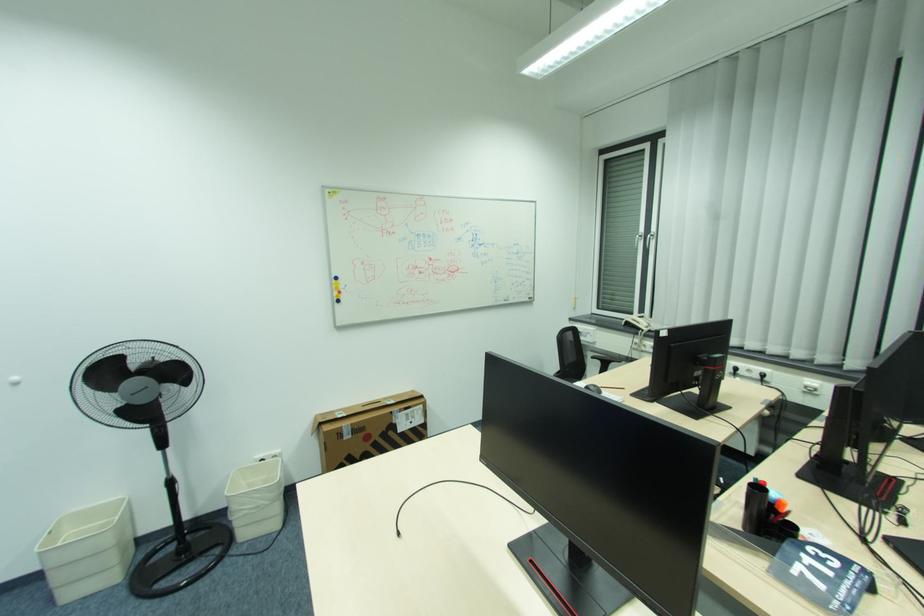
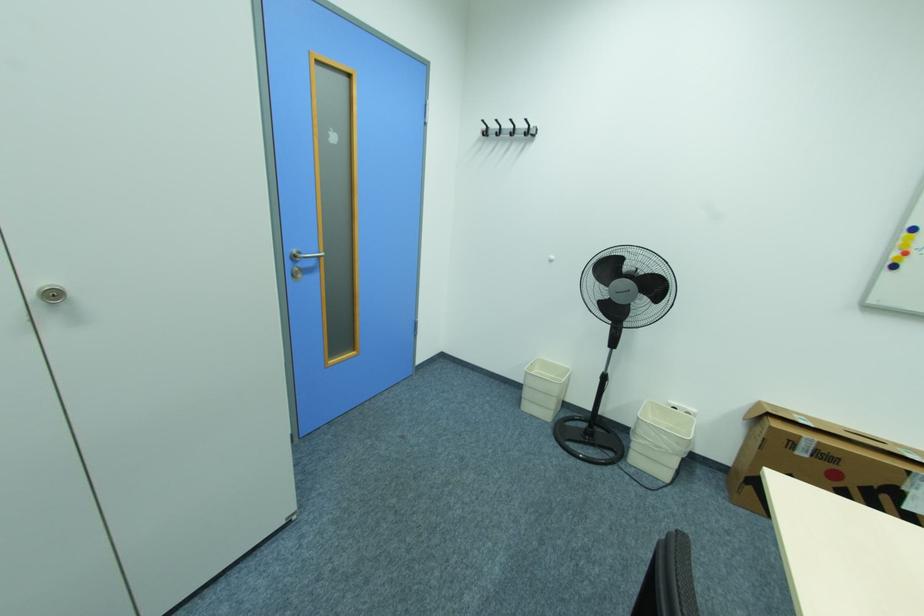
The point at (63, 578) is marked in the first image. Where is the corresponding point in the second image?

(531, 394)